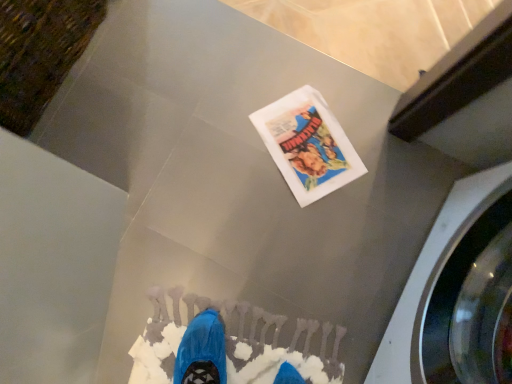
Locate an element on the screen. The width and height of the screenshot is (512, 384). free point to the right of white paper flyer at center is located at coordinates (385, 170).